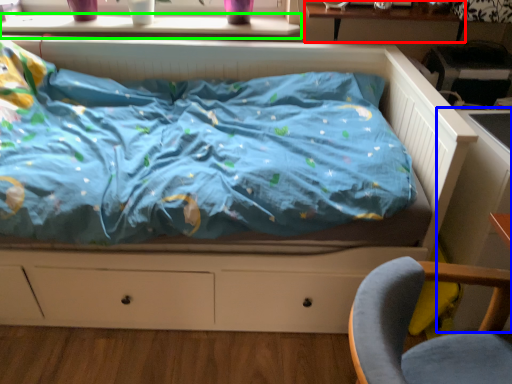
Question: Which is farther away from table (highlighted by a red box)? table (highlighted by a blue box) or window sill (highlighted by a green box)?

Choices:
 (A) table
 (B) window sill

Answer: (A)